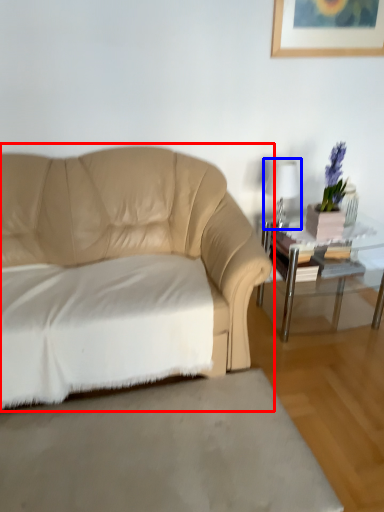
Question: Which point is closer to the camera, studio couch (highlighted by a red box) or table lamp (highlighted by a blue box)?

Choices:
 (A) studio couch
 (B) table lamp

Answer: (A)